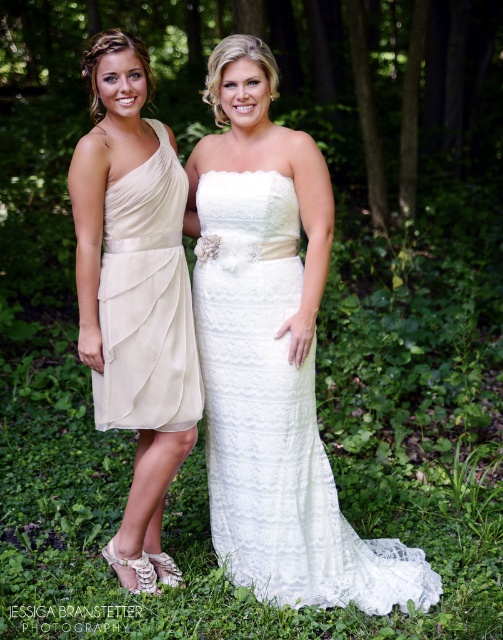
Is lace/embroidered dress at center positioned in front of ivory lace dress at center?

No, it is behind ivory lace dress at center.

Identify the location of lace/embroidered dress at center. click(x=276, y=417).

Does ivory lace dress at center appear over ivory satin dress at left?

Incorrect, ivory lace dress at center is not positioned above ivory satin dress at left.

Which is below, ivory lace dress at center or ivory satin dress at left?

Positioned lower is ivory lace dress at center.

Identify the location of ivory lace dress at center. (134, 294).

Identify the location of ivory lace dress at center. The width and height of the screenshot is (503, 640). (134, 294).

Measure the distance from lace/embroidered dress at center to ivory satin dress at left.

lace/embroidered dress at center is 31.79 centimeters from ivory satin dress at left.

Who is more forward, (210, 381) or (115, 324)?

Point (115, 324) is more forward.

Does point (400, 561) lie in front of point (165, 316)?

No, (400, 561) is behind (165, 316).

This screenshot has height=640, width=503. In order to click on lace/embroidered dress at center in this screenshot , I will do `click(276, 417)`.